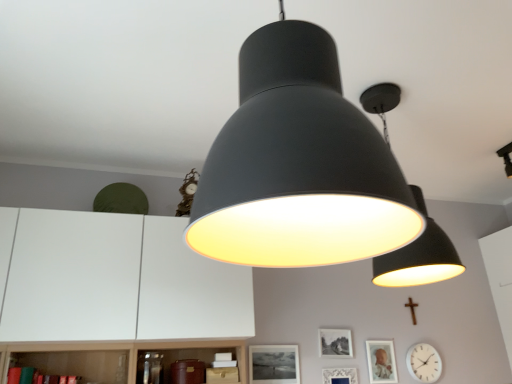
Question: Can you confirm if matte black lampshade at center, which appears as the 2th lamp when viewed from the back, is positioned to the right of wooden cross at lower right?

Choices:
 (A) yes
 (B) no

Answer: (B)

Question: Does matte black lampshade at center, which ranks as the second lamp in right-to-left order, have a lesser width compared to wooden cross at lower right?

Choices:
 (A) yes
 (B) no

Answer: (B)

Question: Is matte black lampshade at center, which ranks as the second lamp in right-to-left order, oriented away from wooden cross at lower right?

Choices:
 (A) no
 (B) yes

Answer: (A)

Question: Does matte black lampshade at center, which ranks as the second lamp in right-to-left order, have a larger size compared to wooden cross at lower right?

Choices:
 (A) no
 (B) yes

Answer: (B)

Question: From the image's perspective, is matte black lampshade at center, which appears as the 2th lamp when viewed from the back, located above wooden cross at lower right?

Choices:
 (A) yes
 (B) no

Answer: (A)

Question: From their relative heights in the image, would you say black matte picture frame at center, which is the 4th picture frame from right to left, is taller or shorter than white glossy clock at lower right?

Choices:
 (A) short
 (B) tall

Answer: (A)

Question: From the image's perspective, is black matte picture frame at center, which ranks as the 1th picture frame in left-to-right order, positioned above or below white glossy clock at lower right?

Choices:
 (A) below
 (B) above

Answer: (B)

Question: Based on their sizes in the image, would you say black matte picture frame at center, which is the 4th picture frame from right to left, is bigger or smaller than white glossy clock at lower right?

Choices:
 (A) small
 (B) big

Answer: (A)

Question: Relative to white glossy clock at lower right, is black matte picture frame at center, which ranks as the 1th picture frame in left-to-right order, in front or behind?

Choices:
 (A) front
 (B) behind

Answer: (A)

Question: Considering the positions of point (334, 352) and point (384, 370), is point (334, 352) closer or farther from the camera than point (384, 370)?

Choices:
 (A) closer
 (B) farther

Answer: (A)

Question: From the image's perspective, is matte black picture frame at center, arranged as the 3th picture frame when viewed from the right, positioned above or below matte silver picture frame at lower right, the fourth picture frame positioned from the left?

Choices:
 (A) above
 (B) below

Answer: (A)

Question: Would you say matte black picture frame at center, arranged as the 3th picture frame when viewed from the right, is inside or outside matte silver picture frame at lower right, the 1th picture frame from the right?

Choices:
 (A) outside
 (B) inside

Answer: (A)

Question: In the image, is matte black picture frame at center, arranged as the 3th picture frame when viewed from the right, positioned in front of or behind matte silver picture frame at lower right, the fourth picture frame positioned from the left?

Choices:
 (A) front
 (B) behind

Answer: (A)

Question: Considering the positions of point (414, 311) and point (433, 273), is point (414, 311) closer or farther from the camera than point (433, 273)?

Choices:
 (A) farther
 (B) closer

Answer: (A)

Question: Would you say wooden cross at lower right is to the left or to the right of matte black lampshade at upper center, which appears as the 2th lamp when viewed from the left, in the picture?

Choices:
 (A) right
 (B) left

Answer: (A)